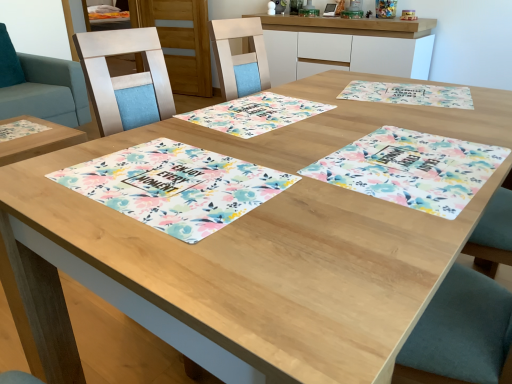
In order to click on vacant space behind floral fabric placemat at center, the 1th place mat when ordered from left to right in this screenshot , I will do `click(224, 128)`.